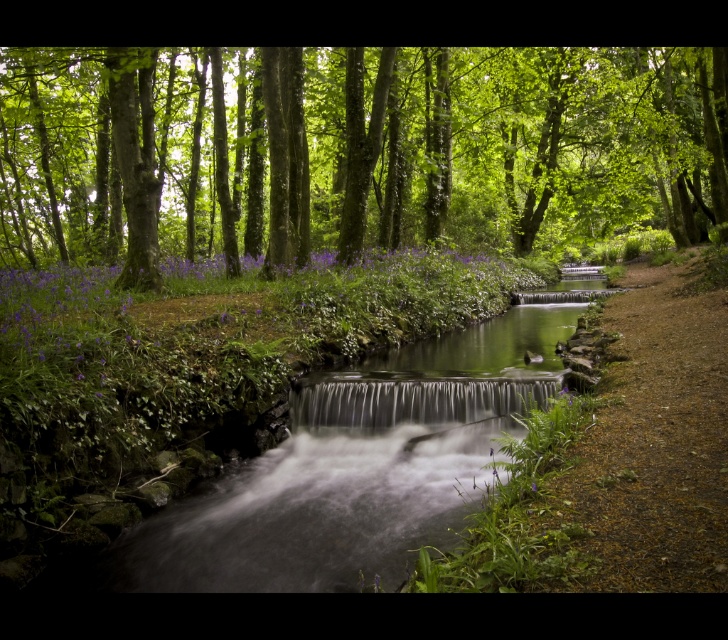
Question: Which object is farther from the camera taking this photo?

Choices:
 (A) clear glass waterfall at center
 (B) green leafy tree at center

Answer: (B)

Question: Which point appears farthest from the camera in this image?

Choices:
 (A) (205, 164)
 (B) (300, 401)

Answer: (A)

Question: Does green leafy tree at center appear under clear glass waterfall at center?

Choices:
 (A) no
 (B) yes

Answer: (A)

Question: Is green leafy tree at center below clear glass waterfall at center?

Choices:
 (A) yes
 (B) no

Answer: (B)

Question: In this image, where is green leafy tree at center located relative to clear glass waterfall at center?

Choices:
 (A) below
 (B) above

Answer: (B)